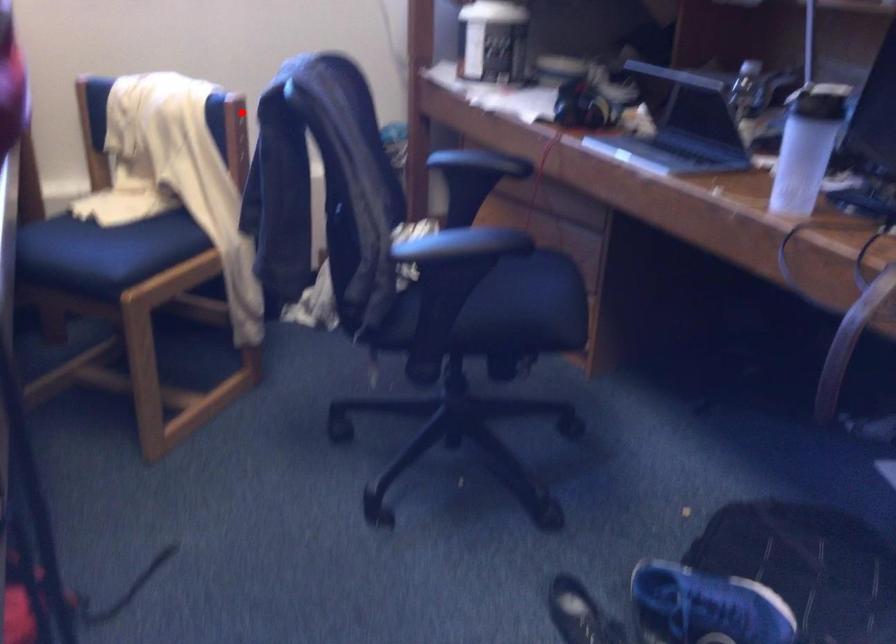
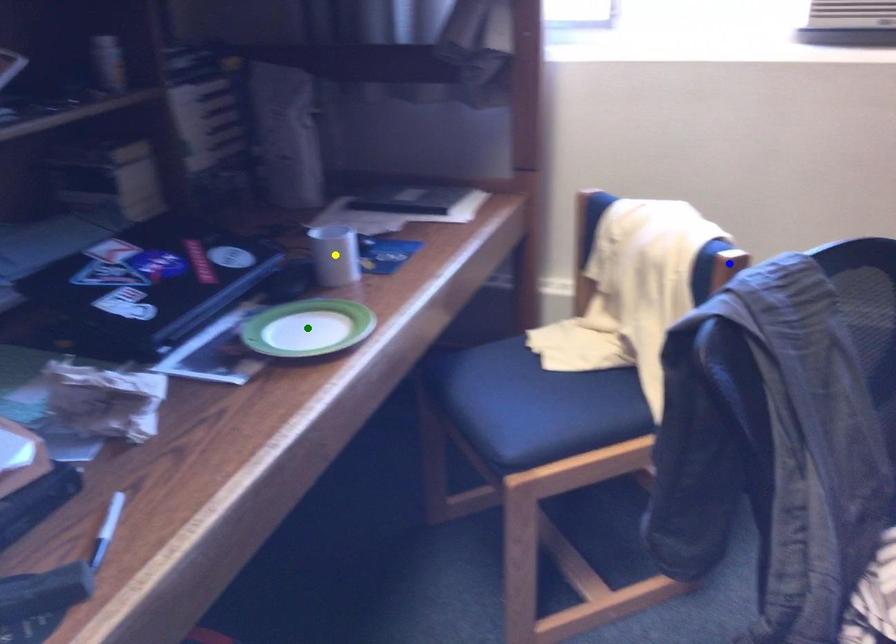
Question: I am providing you with two images of the same scene from different viewpoints. A red point is marked on the first image. You are given multiple points on the second image. Can you choose the point in image 2 that corresponds to the point in image 1?

Choices:
 (A) green point
 (B) blue point
 (C) yellow point

Answer: (B)